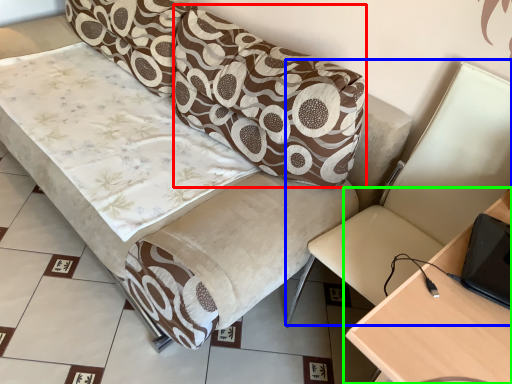
Question: Which is nearer to the pillow (highlighted by a red box)? swivel chair (highlighted by a blue box) or table (highlighted by a green box).

Choices:
 (A) swivel chair
 (B) table

Answer: (A)